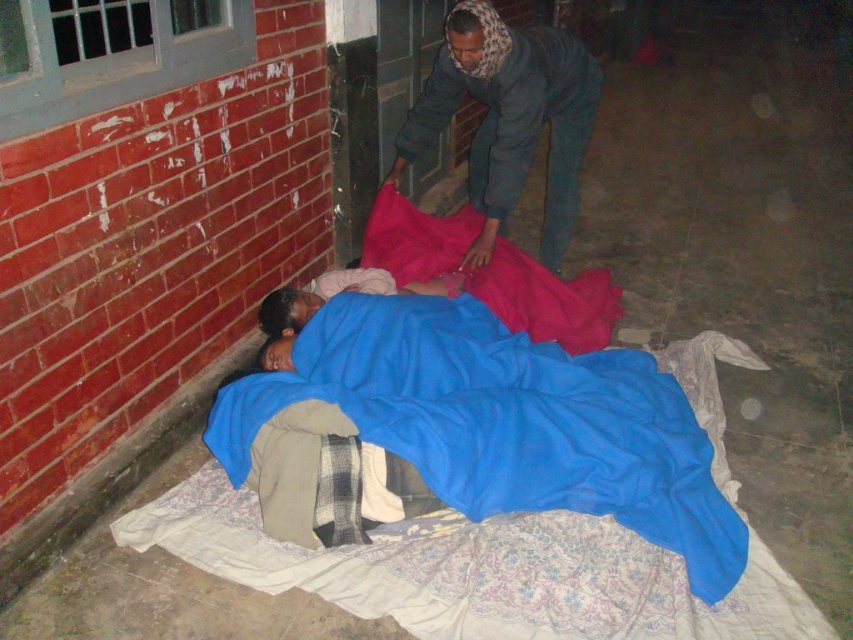
You are a photographer setting up a night shoot in this area. You need to place a 1.2 meter tall equipment stand between the blue fabric at lower left and the matte pink fabric at center. Based on their heights, will the stand fit vertically between them without touching either fabric?

The blue fabric at lower left is much taller than the matte pink fabric at center. Since the equipment stand is 1.2 meters tall, it may not fit vertically between them if the blue fabric is taller than 1.2 meters. However, the exact height of the fabrics isn not provided, so we cannot definitively determine if the stand will fit without additional measurements.